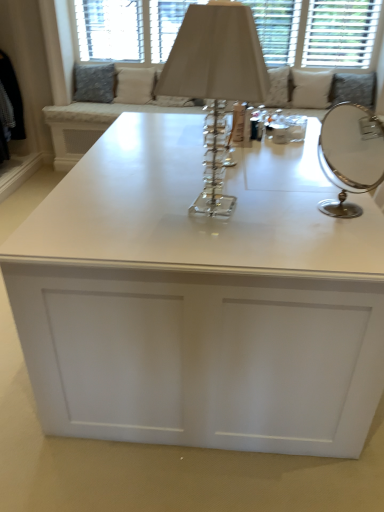
Where is `free location above beige fabric pillow at upper center, arranged as the 2th pillow when viewed from the left (from a real-world perspective)`? free location above beige fabric pillow at upper center, arranged as the 2th pillow when viewed from the left (from a real-world perspective) is located at coordinates (134, 62).